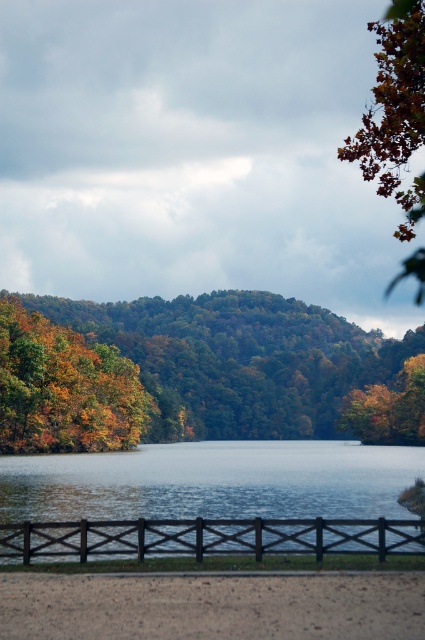
Can you confirm if clear water at center is thinner than orange leafy tree at upper right?

Yes, clear water at center is thinner than orange leafy tree at upper right.

Who is higher up, clear water at center or orange leafy tree at upper right?

Positioned higher is orange leafy tree at upper right.

The height and width of the screenshot is (640, 425). I want to click on clear water at center, so click(212, 499).

Does point (189, 538) come in front of point (277, 522)?

No.

Based on the photo, how much distance is there between clear water at center and black wood fence at lower center?

clear water at center is 62.30 meters away from black wood fence at lower center.

Is point (280, 472) positioned before point (260, 522)?

No.

Where is `clear water at center`? The height and width of the screenshot is (640, 425). clear water at center is located at coordinates (212, 499).

Describe the element at coordinates (238, 360) in the screenshot. I see `autumn leaves at center` at that location.

Which is more to the left, autumn leaves at center or autumn leaves at left?

autumn leaves at left is more to the left.

Does point (209, 308) lie behind point (64, 444)?

Yes, point (209, 308) is farther from viewer.

The image size is (425, 640). Identify the location of autumn leaves at center. (238, 360).